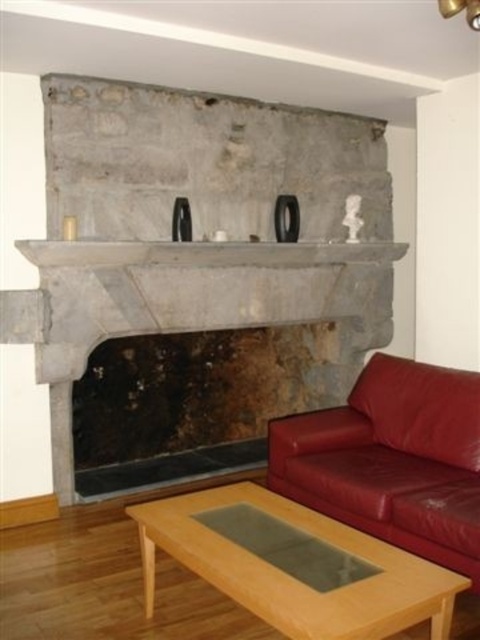
Question: Which of the following is the farthest from the observer?

Choices:
 (A) gray stone mantle at center
 (B) natural stone fireplace at center
 (C) light brown wood coffee table at lower center
 (D) matte leather couch at center

Answer: (B)

Question: Does natural stone fireplace at center have a lesser width compared to gray stone mantle at center?

Choices:
 (A) no
 (B) yes

Answer: (A)

Question: Does natural stone fireplace at center have a greater width compared to matte leather couch at center?

Choices:
 (A) yes
 (B) no

Answer: (A)

Question: Based on their relative distances, which object is farther from the light brown wood coffee table at lower center?

Choices:
 (A) natural stone fireplace at center
 (B) matte leather couch at center
 (C) gray stone mantle at center

Answer: (C)

Question: Which of the following is the farthest from the observer?

Choices:
 (A) (348, 326)
 (B) (435, 461)
 (C) (66, 252)

Answer: (A)

Question: Does natural stone fireplace at center appear under gray stone mantle at center?

Choices:
 (A) yes
 (B) no

Answer: (A)